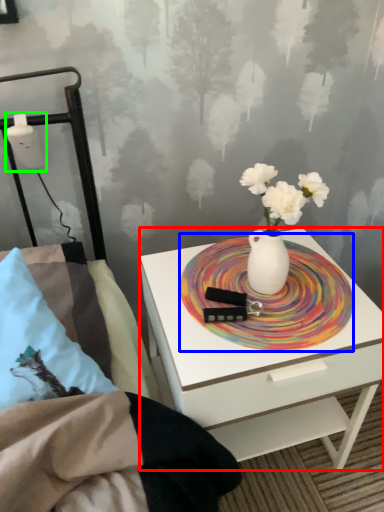
Question: Estimate the real-world distances between objects in this image. Which object is closer to nightstand (highlighted by a red box), platter (highlighted by a blue box) or table lamp (highlighted by a green box)?

Choices:
 (A) platter
 (B) table lamp

Answer: (A)